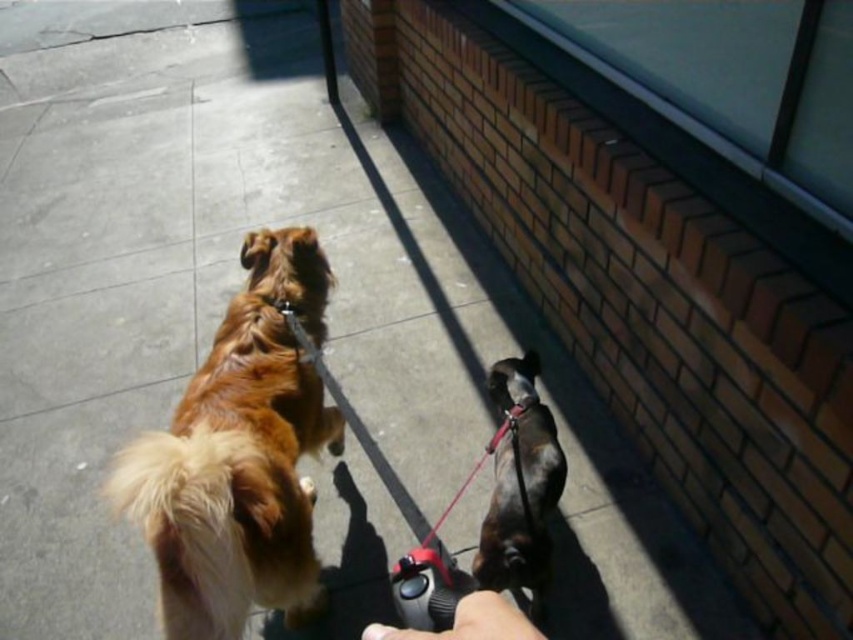
Question: Does golden fur dog at center come behind smooth leather leash at lower center?

Choices:
 (A) yes
 (B) no

Answer: (A)

Question: Which object is the closest to the golden fur dog at center?

Choices:
 (A) smooth nylon leash at center
 (B) brown fur dog at lower right

Answer: (B)

Question: Which point appears closest to the camera in this image?

Choices:
 (A) (554, 492)
 (B) (485, 612)
 (C) (218, 476)

Answer: (B)

Question: Which point is farther to the camera?

Choices:
 (A) (491, 440)
 (B) (273, 516)

Answer: (A)

Question: Considering the relative positions of golden fur dog at center and smooth nylon leash at center in the image provided, where is golden fur dog at center located with respect to smooth nylon leash at center?

Choices:
 (A) right
 (B) left

Answer: (B)

Question: Does brown fur dog at lower right appear over smooth nylon leash at center?

Choices:
 (A) yes
 (B) no

Answer: (B)